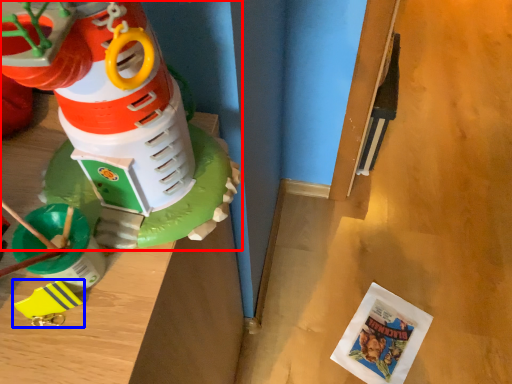
Question: Which point is further to the camera, toy (highlighted by a red box) or toy (highlighted by a blue box)?

Choices:
 (A) toy
 (B) toy

Answer: (B)